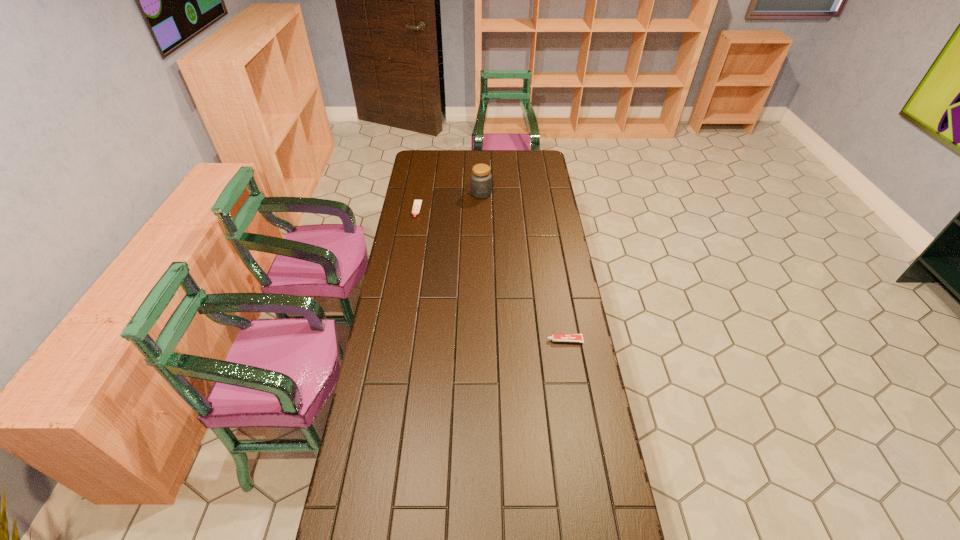
Find the location of a particular element. This screenshot has height=540, width=960. the second object from left to right is located at coordinates (481, 179).

This screenshot has height=540, width=960. In order to click on the farthest object in this screenshot , I will do `click(481, 179)`.

Identify the location of the second farthest object. The height and width of the screenshot is (540, 960). (417, 203).

At what (x,y) coordinates should I click in order to perform the action: click on the leftmost object. Please return your answer as a coordinate pair (x, y). The height and width of the screenshot is (540, 960). Looking at the image, I should click on (417, 203).

The width and height of the screenshot is (960, 540). What are the coordinates of `the rightmost object` in the screenshot? It's located at (555, 337).

What are the coordinates of `the nearest object` in the screenshot? It's located at pos(555,337).

The width and height of the screenshot is (960, 540). What are the coordinates of `free location located 0.360m on the surface of the tallest object near the warning symbol` in the screenshot? It's located at (481, 246).

Where is `free space located on the back of the left toothpaste`? Image resolution: width=960 pixels, height=540 pixels. free space located on the back of the left toothpaste is located at coordinates pyautogui.click(x=422, y=181).

Where is `free space located at the nozzle of the right toothpaste`? free space located at the nozzle of the right toothpaste is located at coordinates (522, 340).

Find the location of `vacant area situated at the nozzle of the right toothpaste`. vacant area situated at the nozzle of the right toothpaste is located at coordinates (498, 340).